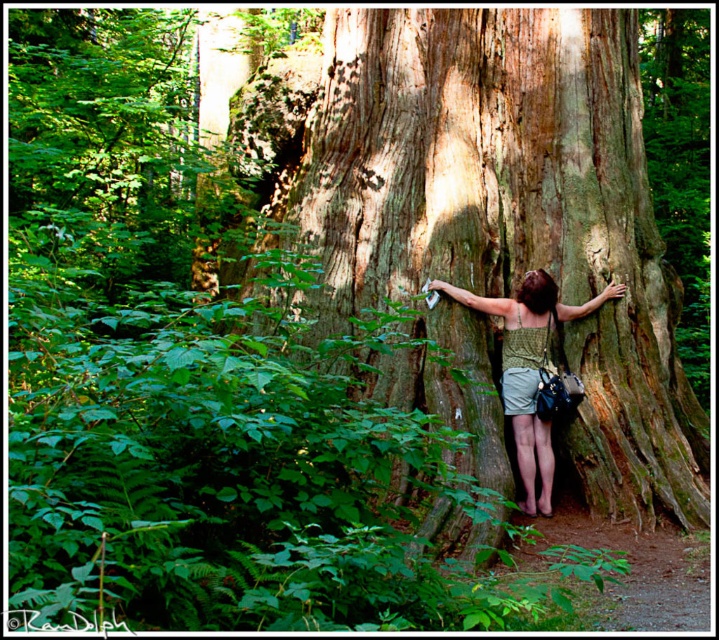
Which is in front, point (490, 339) or point (526, 339)?

Point (526, 339) is in front.

Is point (485, 285) farther from viewer compared to point (528, 504)?

That is True.

Identify the location of smooth brown bark at center. The image size is (719, 640). (508, 211).